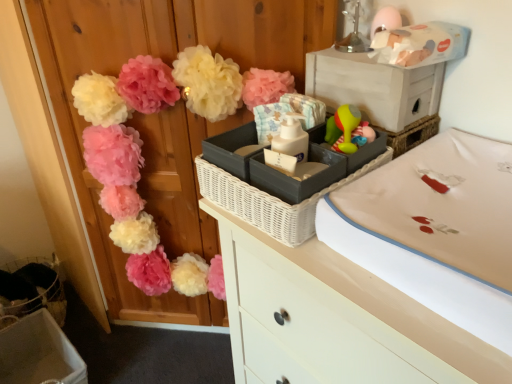
Question: Considering the positions of matte pink pom-poms at upper left and matte gray storage box at upper right, which is counted as the first storage box, starting from the front, in the image, is matte pink pom-poms at upper left taller or shorter than matte gray storage box at upper right, which is counted as the first storage box, starting from the front,?

Choices:
 (A) short
 (B) tall

Answer: (B)

Question: Considering the positions of matte pink pom-poms at upper left and matte gray storage box at upper right, which is counted as the first storage box, starting from the front, in the image, is matte pink pom-poms at upper left wider or thinner than matte gray storage box at upper right, which is counted as the first storage box, starting from the front,?

Choices:
 (A) thin
 (B) wide

Answer: (B)

Question: Which object is positioned farthest from the matte pink pom-poms at upper left?

Choices:
 (A) beige fabric changing pad at center-right
 (B) matte gray storage box at upper right, the first storage box in the top-to-bottom sequence
 (C) white glossy chest of drawers at upper center
 (D) black wicker basket at center
 (E) matte plastic storage box at lower left, placed as the second storage box when sorted from right to left

Answer: (A)

Question: Based on their relative distances, which object is nearer to the white glossy chest of drawers at upper center?

Choices:
 (A) black wicker basket at center
 (B) matte gray storage box at upper right, positioned as the 1th storage box in right-to-left order
 (C) matte plastic storage box at lower left, placed as the second storage box when sorted from right to left
 (D) matte pink pom-poms at upper left
 (E) beige fabric changing pad at center-right

Answer: (A)